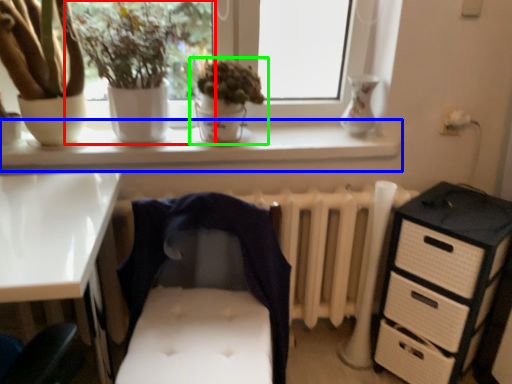
Question: Which object is positioned closest to houseplant (highlighted by a red box)? Select from window sill (highlighted by a blue box) and houseplant (highlighted by a green box).

Choices:
 (A) window sill
 (B) houseplant

Answer: (B)